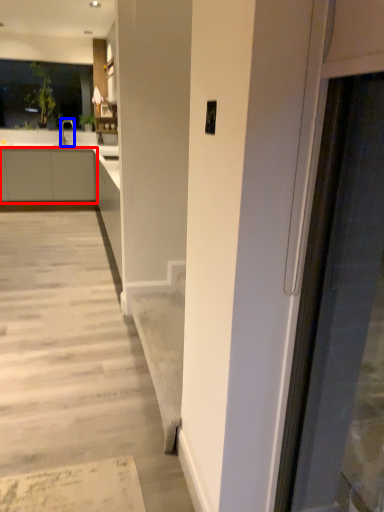
Question: Among these objects, which one is farthest to the camera, cabinetry (highlighted by a red box) or tap (highlighted by a blue box)?

Choices:
 (A) cabinetry
 (B) tap

Answer: (B)